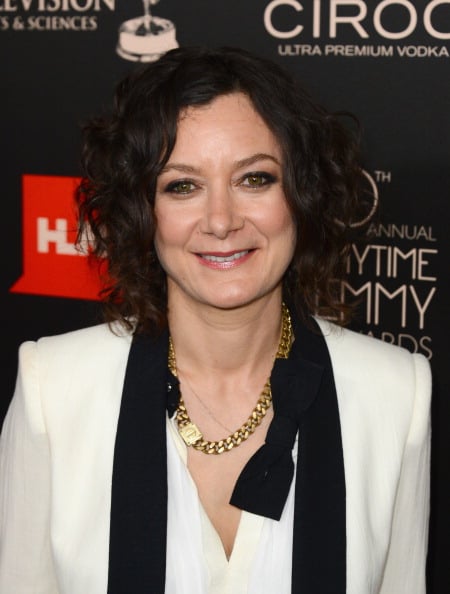
Where is `backdrop`? The width and height of the screenshot is (450, 594). backdrop is located at coordinates (433, 181).